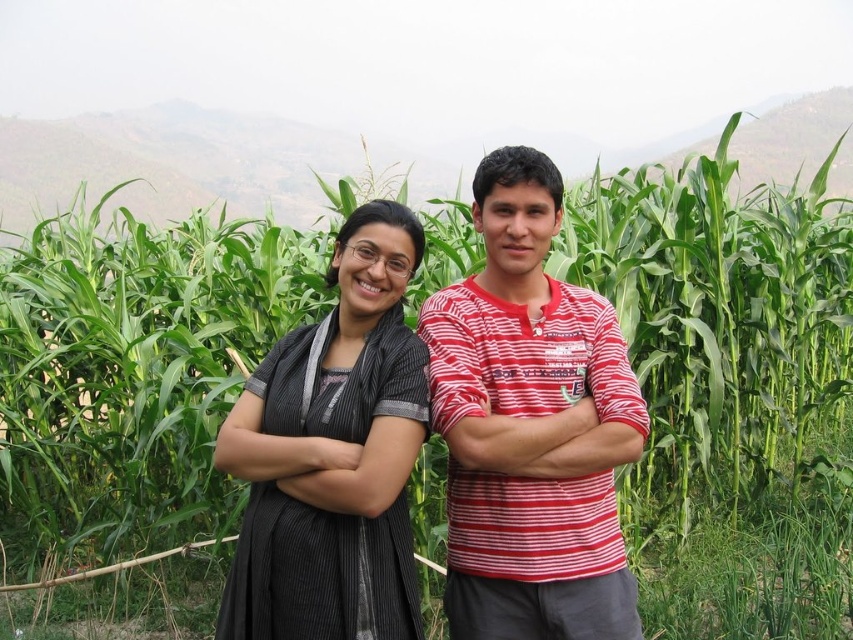
You are a fashion designer observing the two outfits in the image. The striped cotton shirt at center and the matte black dress at center are both placed on a mannequin. If you want to create a new outfit that combines elements from both, which garment should you use as the base to ensure the combined outfit isn not too bulky? Explain your reasoning.

The striped cotton shirt at center has a larger width than the matte black dress at center. To avoid bulkiness, the matte black dress at center should be used as the base since it is narrower and less likely to add excessive volume when combined with other elements.

You are standing in front of the cornfield and see the point at coordinates [531,426]. What object is located at this point?

The point at coordinates [531,426] corresponds to the striped cotton shirt at center.